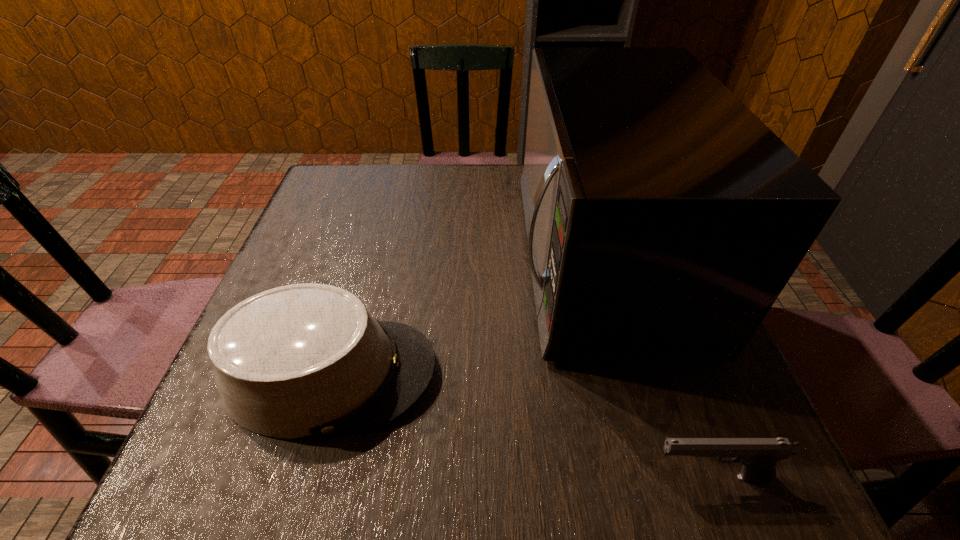
The image size is (960, 540). What are the coordinates of `free spot between the microwave oven and the hat` in the screenshot? It's located at (465, 316).

Locate an element on the screen. empty space between the pistol and the leftmost object is located at coordinates (520, 425).

Where is `unoccupied position between the pistol and the tallest object`? This screenshot has width=960, height=540. unoccupied position between the pistol and the tallest object is located at coordinates click(654, 368).

I want to click on free space that is in between the pistol and the hat, so click(520, 425).

Identify the location of the closest object to the pistol. The height and width of the screenshot is (540, 960). (664, 218).

Image resolution: width=960 pixels, height=540 pixels. Find the location of `object that is the second closest to the leftmost object`. object that is the second closest to the leftmost object is located at coordinates (759, 456).